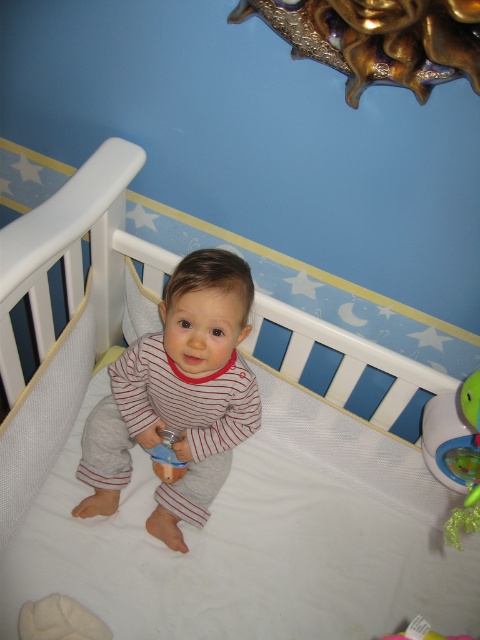
You are a nursery designer checking the space between the striped cotton baby at center and the blue rubber toy at center. Which one is wider?

The striped cotton baby at center is wider than the blue rubber toy at center.

You are a parent standing near the crib and want to hand a pacifier to the striped cotton baby at center. The pacifier requires you to be within 1 meter to reach the baby. Can you successfully hand it over?

The striped cotton baby at center and viewer are 85.83 centimeters apart from each other. Since 85.83 cm is less than 1 meter, you can successfully hand the pacifier to the striped cotton baby at center.